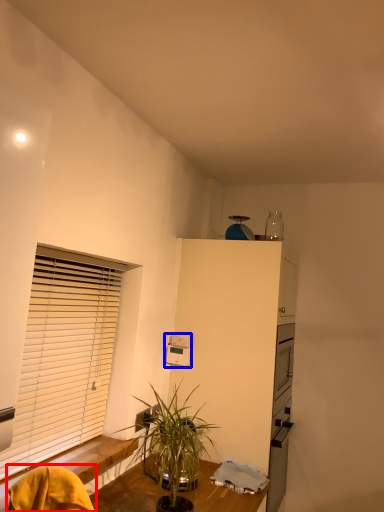
Question: Which point is closer to the camera, swivel chair (highlighted by a red box) or appliance (highlighted by a blue box)?

Choices:
 (A) swivel chair
 (B) appliance

Answer: (A)